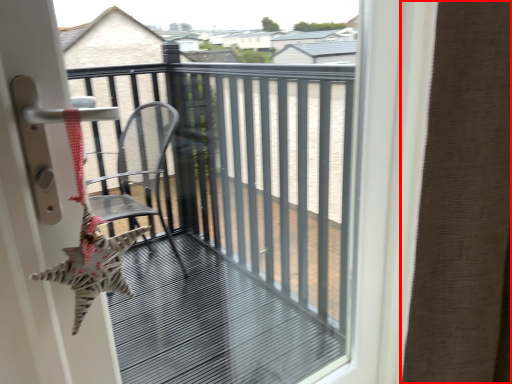
Question: From the image's perspective, what is the correct spatial positioning of curtain (annotated by the red box) in reference to balcony?

Choices:
 (A) below
 (B) above

Answer: (B)